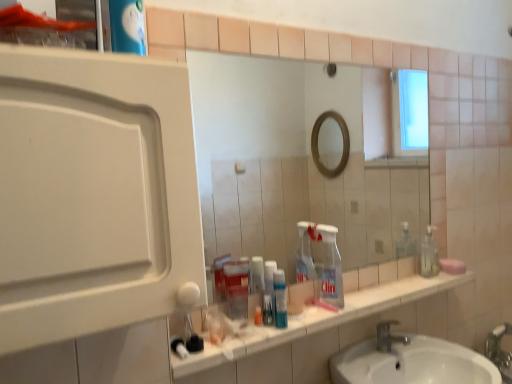
Identify the location of vacant space to the left of silver metallic faucet at lower center. (361, 355).